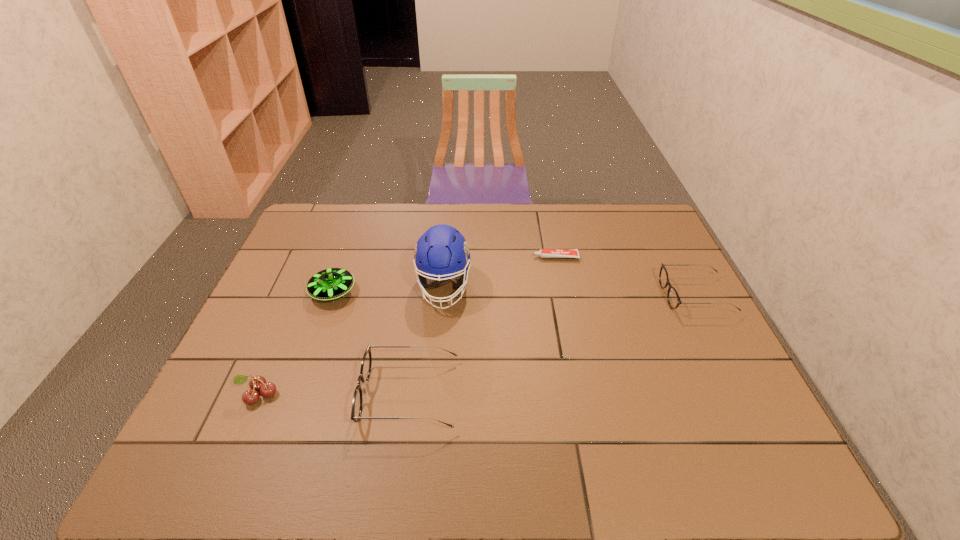
The width and height of the screenshot is (960, 540). Identify the location of free space at the far left corner of the desktop. (332, 211).

Image resolution: width=960 pixels, height=540 pixels. In the image, there is a desktop. In order to click on vacant region at the far right corner in this screenshot , I will do `click(650, 241)`.

Locate an element on the screen. The image size is (960, 540). vacant region between the left spectacles and the cherry is located at coordinates (334, 394).

Locate an element on the screen. This screenshot has height=540, width=960. free space between the left spectacles and the cherry is located at coordinates (334, 394).

Image resolution: width=960 pixels, height=540 pixels. What are the coordinates of `vacant area that lies between the left spectacles and the cherry` in the screenshot? It's located at (334, 394).

This screenshot has width=960, height=540. I want to click on free space between the farthest object and the football helmet, so click(500, 272).

Locate an element on the screen. The height and width of the screenshot is (540, 960). vacant space that is in between the saucer and the taller spectacles is located at coordinates (372, 343).

Locate an element on the screen. This screenshot has width=960, height=540. free space between the cherry and the saucer is located at coordinates (296, 343).

Image resolution: width=960 pixels, height=540 pixels. I want to click on free space between the farthest object and the tallest object, so click(x=500, y=272).

Find the location of `vacant area that lies between the tallest object and the saucer`. vacant area that lies between the tallest object and the saucer is located at coordinates 389,289.